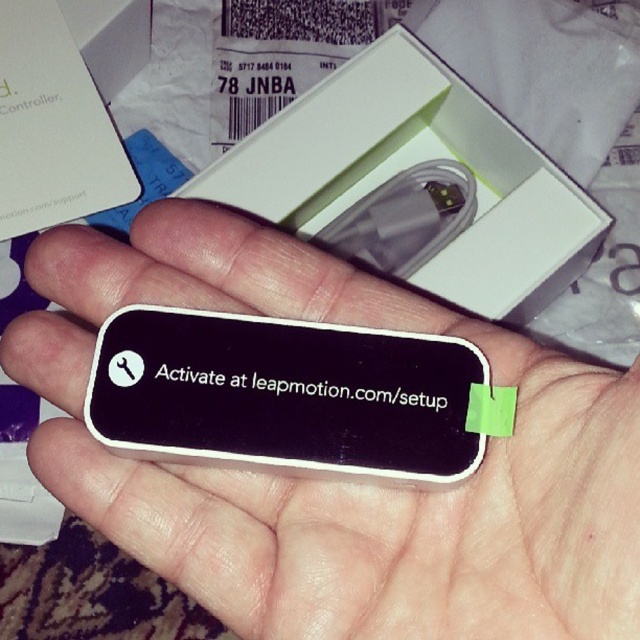
Who is more distant from viewer, (584, 384) or (362, 372)?

The point (362, 372) is more distant.

Does black matte card at center lie behind black matte text at center?

No, black matte card at center is in front of black matte text at center.

Which is in front, point (620, 476) or point (401, 365)?

Point (620, 476)

The image size is (640, 640). What are the coordinates of `black matte card at center` in the screenshot? It's located at (333, 481).

Can you confirm if white matte box at center is shorter than black matte text at center?

In fact, white matte box at center may be taller than black matte text at center.

Based on the photo, is white matte box at center wider than black matte text at center?

Yes.

The width and height of the screenshot is (640, 640). Describe the element at coordinates (410, 168) in the screenshot. I see `white matte box at center` at that location.

Locate an element on the screen. white matte box at center is located at coordinates (410, 168).

Who is more distant from viewer, (588,531) or (600,240)?

The point (600,240) is behind.

Where is `black matte card at center`? The width and height of the screenshot is (640, 640). black matte card at center is located at coordinates (333, 481).